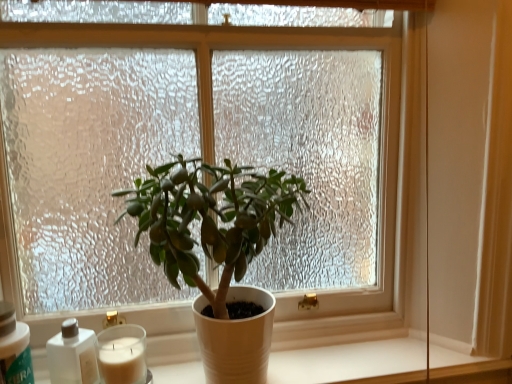
Measure the distance between white wax candle at lower left and camera.

A distance of 32.85 inches exists between white wax candle at lower left and camera.

Measure the distance between point (241, 210) and camera.

Point (241, 210) is 28.94 inches from camera.

Measure the distance between matte white pot at center and camera.

matte white pot at center and camera are 72.84 centimeters apart from each other.

The width and height of the screenshot is (512, 384). I want to click on white matte pot at center, so click(x=349, y=360).

The height and width of the screenshot is (384, 512). In order to click on white wax candle at lower left in this screenshot , I will do `click(122, 361)`.

Considering the positions of objects white matte bottle at lower left, which appears as the 2th bottle when viewed from the left, and matte white pot at center in the image provided, who is more to the right, white matte bottle at lower left, which appears as the 2th bottle when viewed from the left, or matte white pot at center?

Positioned to the right is matte white pot at center.

Considering the relative positions of white matte bottle at lower left, which appears as the 2th bottle when viewed from the left, and matte white pot at center in the image provided, is white matte bottle at lower left, which appears as the 2th bottle when viewed from the left, behind matte white pot at center?

That is True.

From the image's perspective, between white matte bottle at lower left, which appears as the 2th bottle when viewed from the left, and matte white pot at center, who is located below?

white matte bottle at lower left, which appears as the 2th bottle when viewed from the left.

Who is shorter, white matte bottle at lower left, positioned as the first bottle in right-to-left order, or matte white pot at center?

white matte bottle at lower left, positioned as the first bottle in right-to-left order, is shorter.

Can you see white matte bottle at lower left, positioned as the first bottle in right-to-left order, touching white plastic bottle at lower left, which appears as the 2th bottle when viewed from the right?

Yes, white matte bottle at lower left, positioned as the first bottle in right-to-left order, is in contact with white plastic bottle at lower left, which appears as the 2th bottle when viewed from the right.

From a real-world perspective, which is physically above, white matte bottle at lower left, which appears as the 2th bottle when viewed from the left, or white plastic bottle at lower left, which ranks as the first bottle in left-to-right order?

white plastic bottle at lower left, which ranks as the first bottle in left-to-right order, from a real-world perspective.

From the image's perspective, is white matte bottle at lower left, positioned as the first bottle in right-to-left order, over white plastic bottle at lower left, which ranks as the first bottle in left-to-right order?

No, from the image's perspective, white matte bottle at lower left, positioned as the first bottle in right-to-left order, is not over white plastic bottle at lower left, which ranks as the first bottle in left-to-right order.

Which is correct: white matte bottle at lower left, positioned as the first bottle in right-to-left order, is inside white plastic bottle at lower left, which ranks as the first bottle in left-to-right order, or outside of it?

The correct answer is: outside.

Considering the relative sizes of white matte pot at center and white plastic bottle at lower left, which appears as the 2th bottle when viewed from the right, in the image provided, is white matte pot at center wider than white plastic bottle at lower left, which appears as the 2th bottle when viewed from the right,?

Yes.

Is white matte pot at center oriented away from white plastic bottle at lower left, which appears as the 2th bottle when viewed from the right?

No.

From the image's perspective, which bottle is the 2nd one above the white matte pot at center? Please provide its 2D coordinates.

[(14, 348)]

From a real-world perspective, relative to white wax candle at lower left, is matte white pot at center vertically above or below?

Clearly, from a real-world perspective, matte white pot at center is above white wax candle at lower left.

Considering the sizes of objects matte white pot at center and white wax candle at lower left in the image provided, who is bigger, matte white pot at center or white wax candle at lower left?

matte white pot at center.

Between matte white pot at center and white wax candle at lower left, which one appears on the left side from the viewer's perspective?

white wax candle at lower left.

Is matte white pot at center aimed at white wax candle at lower left?

No, matte white pot at center is not turned towards white wax candle at lower left.

Is white plastic bottle at lower left, which ranks as the first bottle in left-to-right order, not close to white matte pot at center?

white plastic bottle at lower left, which ranks as the first bottle in left-to-right order, is actually quite close to white matte pot at center.

Considering the points (10, 378) and (452, 358), which point is in front, point (10, 378) or point (452, 358)?

Point (10, 378)

From the picture: From a real-world perspective, does white plastic bottle at lower left, which appears as the 2th bottle when viewed from the right, sit lower than white matte pot at center?

Incorrect, from a real-world perspective, white plastic bottle at lower left, which appears as the 2th bottle when viewed from the right, is higher than white matte pot at center.

Can you confirm if white plastic bottle at lower left, which ranks as the first bottle in left-to-right order, is shorter than white matte pot at center?

Incorrect, the height of white plastic bottle at lower left, which ranks as the first bottle in left-to-right order, does not fall short of that of white matte pot at center.

Considering the sizes of objects white matte pot at center and white matte bottle at lower left, which appears as the 2th bottle when viewed from the left, in the image provided, who is wider, white matte pot at center or white matte bottle at lower left, which appears as the 2th bottle when viewed from the left,?

Result: white matte pot at center is wider.

How much distance is there between white matte pot at center and white matte bottle at lower left, positioned as the first bottle in right-to-left order?

They are 14.46 inches apart.

From the image's perspective, is white matte pot at center located above white matte bottle at lower left, which appears as the 2th bottle when viewed from the left?

No.

Is white matte pot at center directly adjacent to white matte bottle at lower left, positioned as the first bottle in right-to-left order?

No, white matte pot at center is not beside white matte bottle at lower left, positioned as the first bottle in right-to-left order.

Measure the distance from white plastic bottle at lower left, which ranks as the first bottle in left-to-right order, to white wax candle at lower left.

A distance of 6.82 inches exists between white plastic bottle at lower left, which ranks as the first bottle in left-to-right order, and white wax candle at lower left.

Considering the positions of objects white plastic bottle at lower left, which ranks as the first bottle in left-to-right order, and white wax candle at lower left in the image provided, who is more to the left, white plastic bottle at lower left, which ranks as the first bottle in left-to-right order, or white wax candle at lower left?

white plastic bottle at lower left, which ranks as the first bottle in left-to-right order.

Between white plastic bottle at lower left, which ranks as the first bottle in left-to-right order, and white wax candle at lower left, which one is positioned in front?

white plastic bottle at lower left, which ranks as the first bottle in left-to-right order, is more forward.

Considering the relative sizes of white plastic bottle at lower left, which appears as the 2th bottle when viewed from the right, and white wax candle at lower left in the image provided, is white plastic bottle at lower left, which appears as the 2th bottle when viewed from the right, shorter than white wax candle at lower left?

No.

From the image's perspective, which bottle is the 2nd one below the matte white pot at center? Please provide its 2D coordinates.

[(72, 355)]

You are a GUI agent. You are given a task and a screenshot of the screen. Output one action in this format:
    pyautogui.click(x=<x>, y=<y>)
    Task: Click on the bottle beneath the white plastic bottle at lower left, which appears as the 2th bottle when viewed from the right (from a real-world perspective)
    Image resolution: width=512 pixels, height=384 pixels.
    Given the screenshot: What is the action you would take?
    pyautogui.click(x=72, y=355)

Based on their spatial positions, is white matte bottle at lower left, positioned as the first bottle in right-to-left order, or matte white pot at center closer to white matte pot at center?

matte white pot at center is closer to white matte pot at center.

From the image, which object appears to be farther from white matte bottle at lower left, which appears as the 2th bottle when viewed from the left, matte white pot at center or white wax candle at lower left?

matte white pot at center.

Based on their spatial positions, is white wax candle at lower left or white matte bottle at lower left, which appears as the 2th bottle when viewed from the left, closer to matte white pot at center?

white wax candle at lower left is closer to matte white pot at center.

When comparing their distances from white matte bottle at lower left, positioned as the first bottle in right-to-left order, does matte white pot at center or white plastic bottle at lower left, which appears as the 2th bottle when viewed from the right, seem further?

matte white pot at center.

Estimate the real-world distances between objects in this image. Which object is further from matte white pot at center, white matte pot at center or white matte bottle at lower left, which appears as the 2th bottle when viewed from the left?

The object further to matte white pot at center is white matte bottle at lower left, which appears as the 2th bottle when viewed from the left.

Looking at the image, which one is located closer to white matte pot at center, white wax candle at lower left or matte white pot at center?

white wax candle at lower left.

From the image, which object appears to be farther from white plastic bottle at lower left, which ranks as the first bottle in left-to-right order, white matte pot at center or matte white pot at center?

white matte pot at center is positioned further to the anchor white plastic bottle at lower left, which ranks as the first bottle in left-to-right order.

Based on their spatial positions, is white wax candle at lower left or white matte bottle at lower left, which appears as the 2th bottle when viewed from the left, closer to white matte pot at center?

Among the two, white wax candle at lower left is located nearer to white matte pot at center.

Find the location of a particular element. The width and height of the screenshot is (512, 384). candle located between white plastic bottle at lower left, which ranks as the first bottle in left-to-right order, and white matte pot at center in the left-right direction is located at coordinates (122, 361).

The height and width of the screenshot is (384, 512). What are the coordinates of `houseplant between white wax candle at lower left and white matte pot at center` in the screenshot? It's located at (210, 219).

Where is `bottle between white plastic bottle at lower left, which ranks as the first bottle in left-to-right order, and white wax candle at lower left, in the horizontal direction`? This screenshot has height=384, width=512. bottle between white plastic bottle at lower left, which ranks as the first bottle in left-to-right order, and white wax candle at lower left, in the horizontal direction is located at coordinates point(72,355).

You are a GUI agent. You are given a task and a screenshot of the screen. Output one action in this format:
    pyautogui.click(x=<x>, y=<y>)
    Task: Click on the houseplant between white plastic bottle at lower left, which appears as the 2th bottle when viewed from the right, and white matte pot at center
    The width and height of the screenshot is (512, 384).
    Given the screenshot: What is the action you would take?
    pyautogui.click(x=210, y=219)